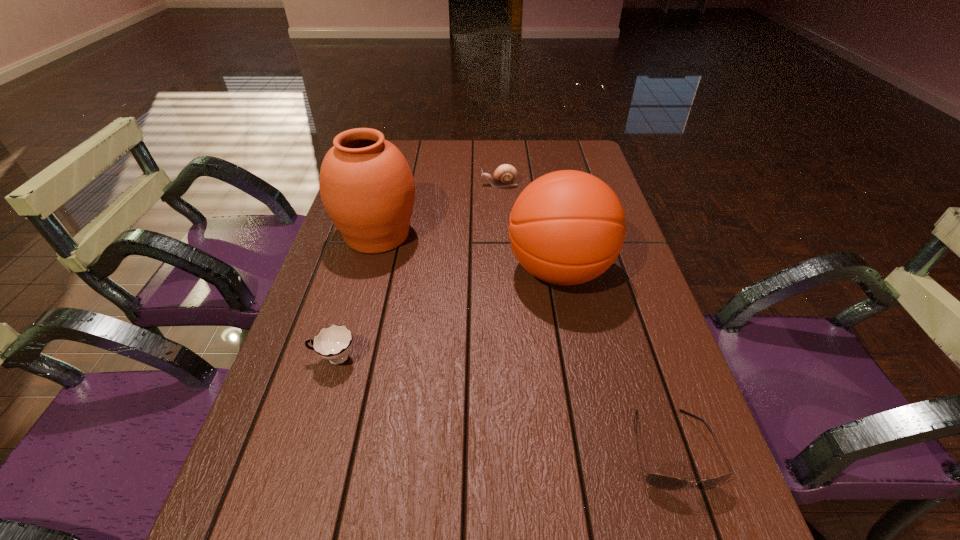
Image resolution: width=960 pixels, height=540 pixels. In order to click on vacant space situated 0.190m on the front-facing side of the escargot in this screenshot , I will do `click(421, 185)`.

Locate an element on the screen. urn present at the left edge is located at coordinates (367, 188).

You are a GUI agent. You are given a task and a screenshot of the screen. Output one action in this format:
    pyautogui.click(x=<x>, y=<y>)
    Task: Click on the cup that is at the left edge
    Image resolution: width=960 pixels, height=540 pixels.
    Given the screenshot: What is the action you would take?
    pyautogui.click(x=333, y=343)

Image resolution: width=960 pixels, height=540 pixels. In order to click on basketball that is positioned at the right edge in this screenshot , I will do `click(567, 227)`.

You are a GUI agent. You are given a task and a screenshot of the screen. Output one action in this format:
    pyautogui.click(x=<x>, y=<y>)
    Task: Click on the sunglasses at the right edge
    This screenshot has height=540, width=960.
    Given the screenshot: What is the action you would take?
    pyautogui.click(x=663, y=482)

I want to click on vacant space at the far edge of the desktop, so click(x=470, y=146).

Find the location of `free space at the left edge of the desktop`. free space at the left edge of the desktop is located at coordinates point(259,429).

In the image, there is a desktop. What are the coordinates of `vacant area at the right edge` in the screenshot? It's located at (606, 323).

Identify the location of free space at the far right corner of the desktop. (579, 160).

Locate an element on the screen. Image resolution: width=960 pixels, height=540 pixels. empty space that is in between the farthest object and the nearest object is located at coordinates (586, 317).